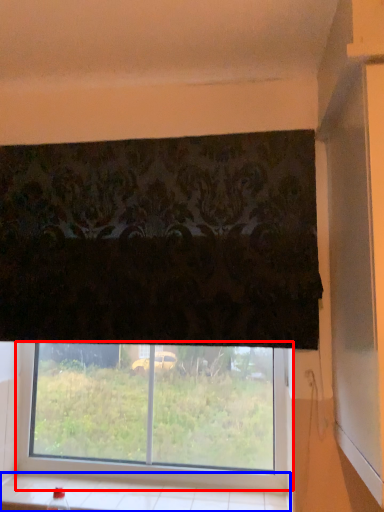
Question: Which object appears farthest to the camera in this image, window (highlighted by a red box) or window sill (highlighted by a blue box)?

Choices:
 (A) window
 (B) window sill

Answer: (A)